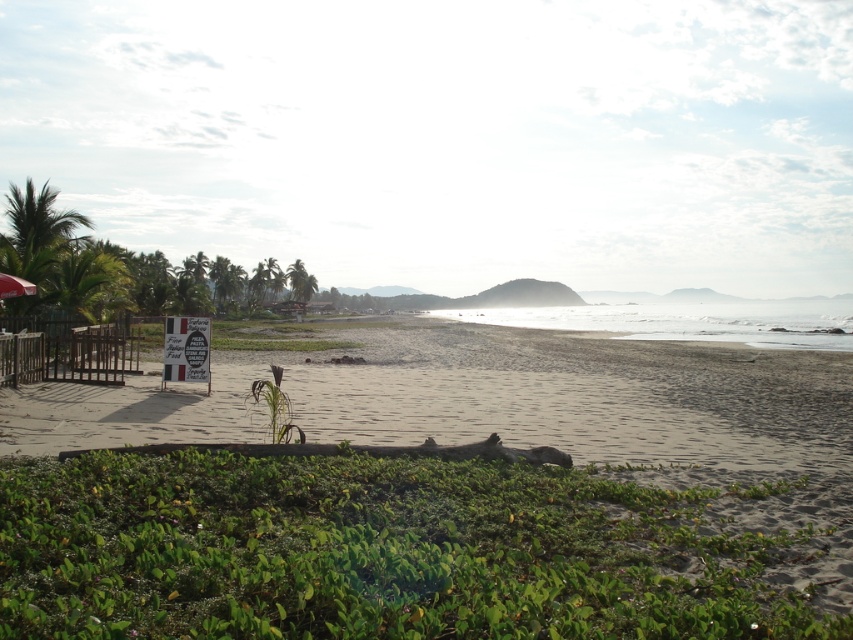
Question: Is green leafy plants at left positioned at the back of matte black umbrella at lower left?

Choices:
 (A) yes
 (B) no

Answer: (A)

Question: Is green leafy plants at left above matte black umbrella at lower left?

Choices:
 (A) yes
 (B) no

Answer: (A)

Question: Is green leafy vegetation at lower center above matte black umbrella at lower left?

Choices:
 (A) no
 (B) yes

Answer: (A)

Question: Estimate the real-world distances between objects in this image. Which object is farther from the green leafy plants at left?

Choices:
 (A) green leafy vegetation at lower center
 (B) matte black umbrella at lower left

Answer: (A)

Question: Which object is closer to the camera taking this photo?

Choices:
 (A) green leafy vegetation at lower center
 (B) green leafy plants at left

Answer: (A)

Question: Estimate the real-world distances between objects in this image. Which object is farther from the green leafy vegetation at lower center?

Choices:
 (A) green leafy plants at left
 (B) matte black umbrella at lower left

Answer: (A)